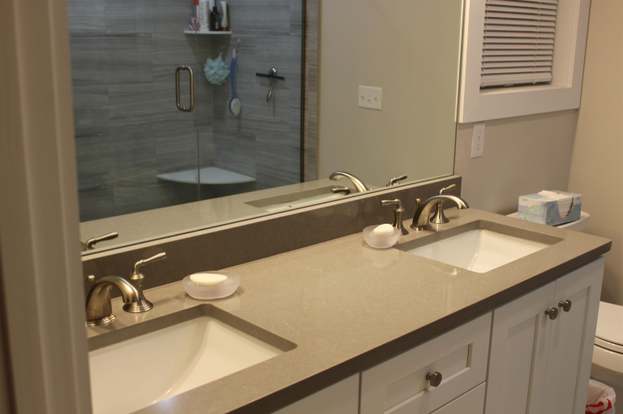
Where is `right sink`? The image size is (623, 414). right sink is located at coordinates (475, 255).